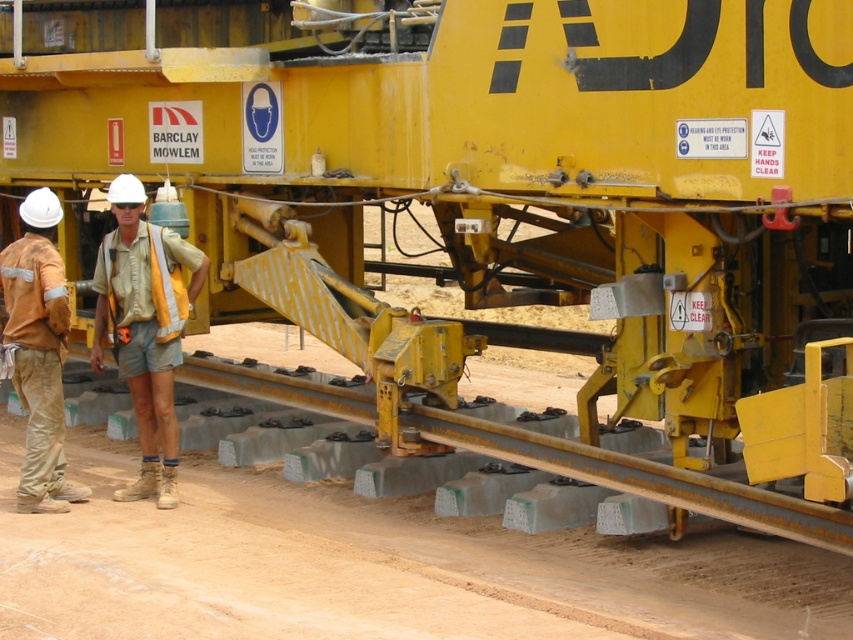
Question: Which object appears closest to the camera in this image?

Choices:
 (A) camouflage fabric shirt at center
 (B) orange fabric pants at left

Answer: (B)

Question: Can you confirm if camouflage fabric shirt at center is wider than orange fabric pants at left?

Choices:
 (A) no
 (B) yes

Answer: (B)

Question: Which of the following is the closest to the observer?

Choices:
 (A) (57, 454)
 (B) (165, 381)

Answer: (B)

Question: Does camouflage fabric shirt at center have a greater width compared to orange fabric pants at left?

Choices:
 (A) yes
 (B) no

Answer: (A)

Question: Does camouflage fabric shirt at center appear over orange fabric pants at left?

Choices:
 (A) no
 (B) yes

Answer: (B)